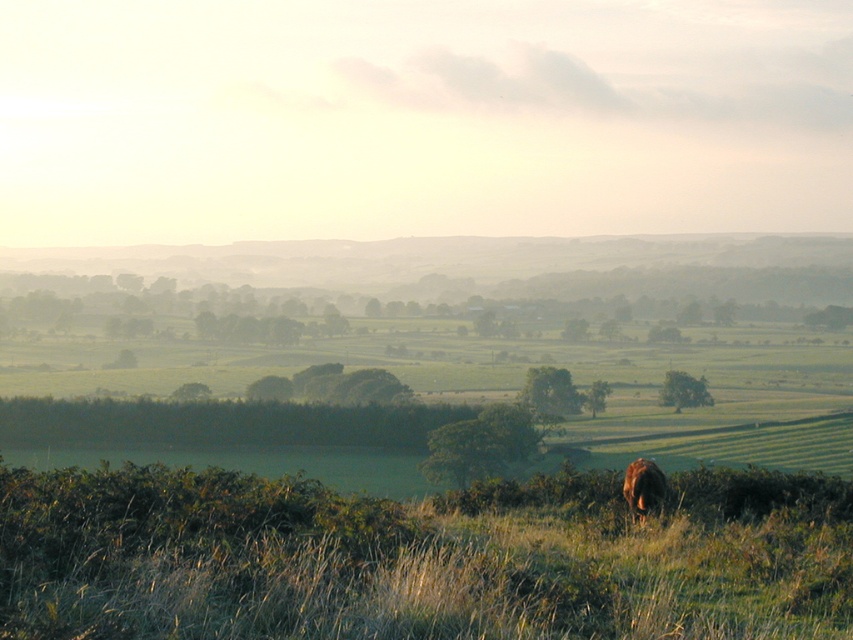
Does green grassy at lower center appear under brown furry animal at lower center?

No.

Is green grassy at lower center in front of brown furry animal at lower center?

Yes, it is.

What are the coordinates of `green grassy at lower center` in the screenshot? It's located at 413,560.

Identify the location of green grassy at lower center. This screenshot has height=640, width=853. (413, 560).